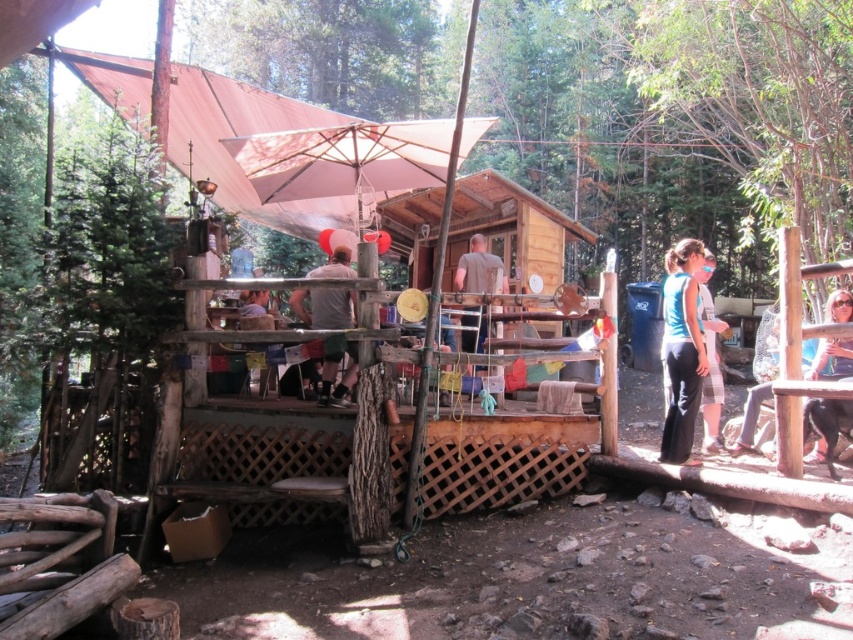
Question: Can you confirm if light brown wooden chair at center is bigger than black leather jacket at lower right?

Choices:
 (A) yes
 (B) no

Answer: (A)

Question: Does gray fabric shirt at center lie behind black leather jacket at lower right?

Choices:
 (A) no
 (B) yes

Answer: (B)

Question: Can you confirm if light brown wooden chair at center is bigger than blue fabric shirt at center?

Choices:
 (A) no
 (B) yes

Answer: (A)

Question: Which of the following is the closest to the observer?

Choices:
 (A) (712, 404)
 (B) (685, 342)
 (C) (834, 356)
 (D) (473, 330)

Answer: (C)

Question: Which is farther from the gray fabric shirt at center?

Choices:
 (A) black leather jacket at lower right
 (B) blue fabric shirt at center
 (C) light brown wooden chair at center

Answer: (A)

Question: Estimate the real-world distances between objects in this image. Which object is farther from the light brown wooden chair at center?

Choices:
 (A) blue fabric pants at lower right
 (B) black leather jacket at lower right
 (C) gray fabric shirt at center

Answer: (B)